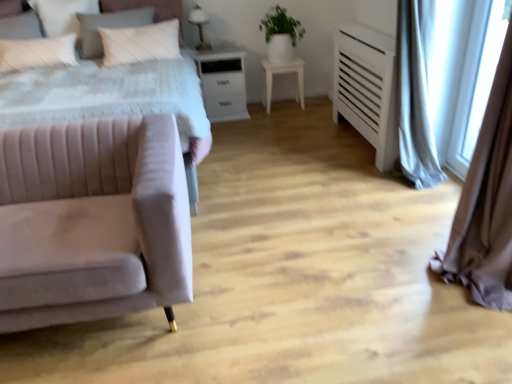
I want to click on free location in front of white matte table at center, so click(x=288, y=117).